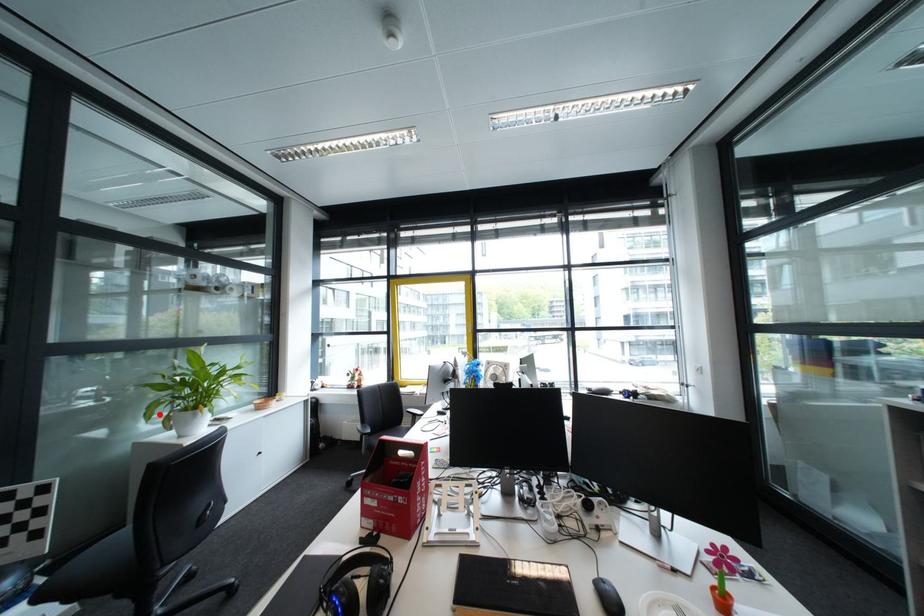
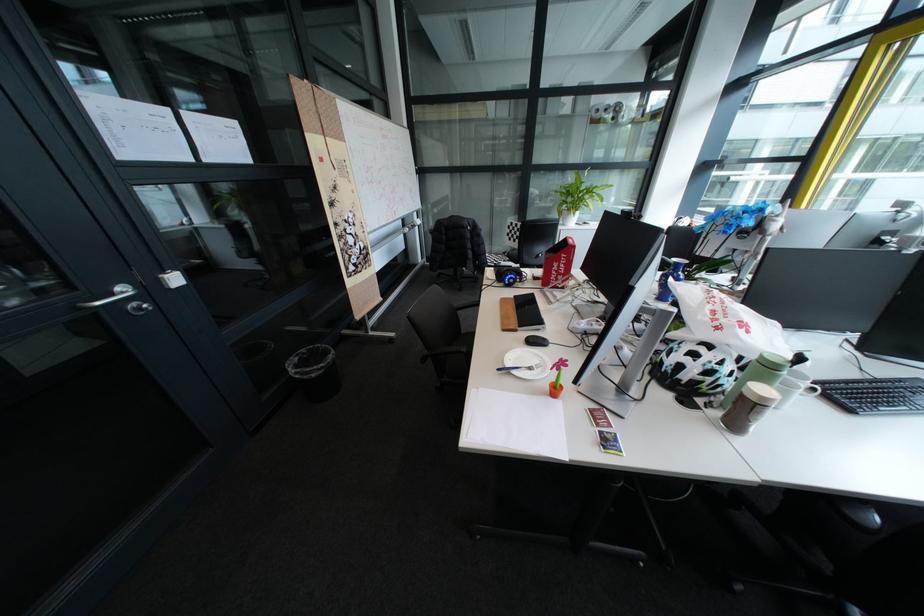
Where in the second image is the point corresponding to the highlighted location from the first image?

(572, 209)